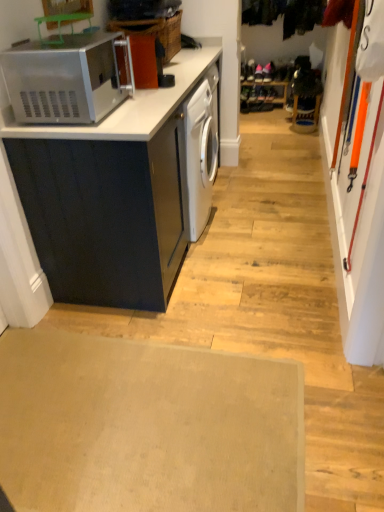
Question: Does satin silver microwave at upper left have a greater height compared to matte black cabinet at left?

Choices:
 (A) yes
 (B) no

Answer: (B)

Question: Does satin silver microwave at upper left have a smaller size compared to matte black cabinet at left?

Choices:
 (A) no
 (B) yes

Answer: (B)

Question: Is satin silver microwave at upper left aimed at matte black cabinet at left?

Choices:
 (A) yes
 (B) no

Answer: (B)

Question: Is satin silver microwave at upper left positioned beyond the bounds of matte black cabinet at left?

Choices:
 (A) yes
 (B) no

Answer: (A)

Question: Is satin silver microwave at upper left positioned in front of matte black cabinet at left?

Choices:
 (A) no
 (B) yes

Answer: (B)

Question: Is satin silver microwave at upper left bigger than matte black cabinet at left?

Choices:
 (A) no
 (B) yes

Answer: (A)

Question: Is matte black cabinet at left positioned with its back to satin silver microwave at upper left?

Choices:
 (A) no
 (B) yes

Answer: (A)

Question: Would you say satin silver microwave at upper left is part of matte black cabinet at left's contents?

Choices:
 (A) yes
 (B) no

Answer: (B)

Question: Does matte black cabinet at left come in front of satin silver microwave at upper left?

Choices:
 (A) no
 (B) yes

Answer: (A)

Question: Does matte black cabinet at left have a greater width compared to satin silver microwave at upper left?

Choices:
 (A) no
 (B) yes

Answer: (B)

Question: Can you confirm if matte black cabinet at left is bigger than satin silver microwave at upper left?

Choices:
 (A) no
 (B) yes

Answer: (B)

Question: Considering the relative sizes of matte black cabinet at left and satin silver microwave at upper left in the image provided, is matte black cabinet at left taller than satin silver microwave at upper left?

Choices:
 (A) no
 (B) yes

Answer: (B)

Question: Considering the relative sizes of beige carpet at lower center and satin silver microwave at upper left in the image provided, is beige carpet at lower center thinner than satin silver microwave at upper left?

Choices:
 (A) yes
 (B) no

Answer: (B)